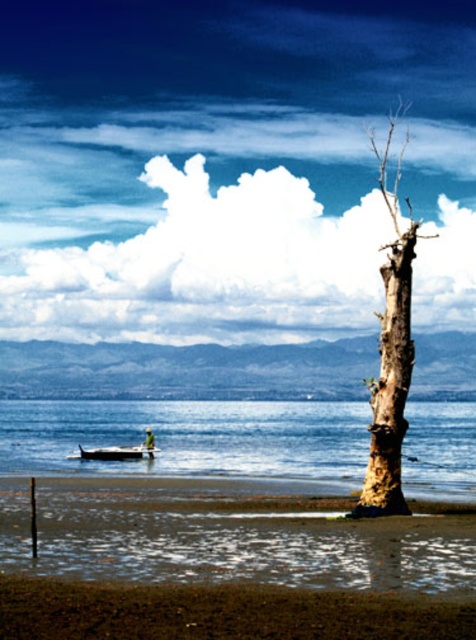
Question: Is brown rough bark tree at right above metallic silver boat at lower left?

Choices:
 (A) no
 (B) yes

Answer: (B)

Question: Which point is farther from the camera taking this photo?

Choices:
 (A) (67, 428)
 (B) (325, 627)

Answer: (A)

Question: Among these objects, which one is farthest from the camera?

Choices:
 (A) metallic silver boat at lower left
 (B) brown sandy beach at lower center
 (C) brown rough bark tree at right
 (D) clear blue water at center

Answer: (A)

Question: Can you confirm if brown sandy beach at lower center is positioned to the left of metallic silver boat at lower left?

Choices:
 (A) no
 (B) yes

Answer: (A)

Question: Which point appears farthest from the camera in this image?

Choices:
 (A) (73, 454)
 (B) (370, 452)
 (C) (376, 595)

Answer: (A)

Question: Does clear blue water at center appear on the right side of brown sandy beach at lower center?

Choices:
 (A) no
 (B) yes

Answer: (A)